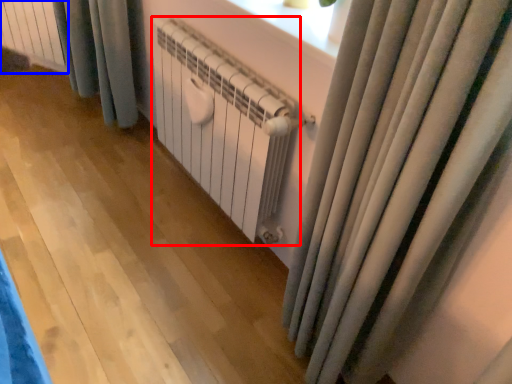
Question: Which of the following is the farthest to the observer, radiator (highlighted by a red box) or radiator (highlighted by a blue box)?

Choices:
 (A) radiator
 (B) radiator

Answer: (B)